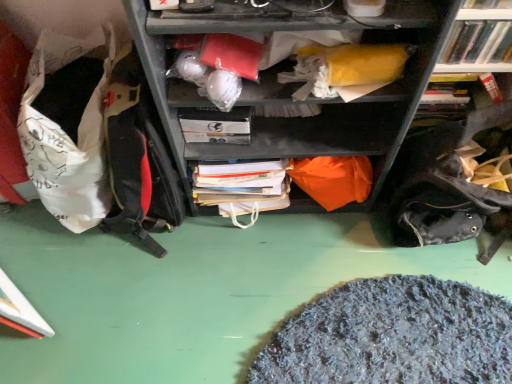
Question: Can we say white plastic books at upper right lies outside white fabric bean bag at left?

Choices:
 (A) yes
 (B) no

Answer: (A)

Question: Can you confirm if white plastic books at upper right is smaller than white fabric bean bag at left?

Choices:
 (A) no
 (B) yes

Answer: (B)

Question: From the image's perspective, is white plastic books at upper right over white fabric bean bag at left?

Choices:
 (A) yes
 (B) no

Answer: (A)

Question: Is white plastic books at upper right with white fabric bean bag at left?

Choices:
 (A) yes
 (B) no

Answer: (B)

Question: Can you confirm if white plastic books at upper right is shorter than white fabric bean bag at left?

Choices:
 (A) yes
 (B) no

Answer: (A)

Question: Does white plastic books at upper right have a larger size compared to white fabric bean bag at left?

Choices:
 (A) yes
 (B) no

Answer: (B)

Question: From a real-world perspective, does white plastic books at upper right stand above white matte paperback book at center?

Choices:
 (A) yes
 (B) no

Answer: (A)

Question: From the image's perspective, is white plastic books at upper right on top of white matte paperback book at center?

Choices:
 (A) yes
 (B) no

Answer: (A)

Question: Does white plastic books at upper right have a lesser width compared to white matte paperback book at center?

Choices:
 (A) yes
 (B) no

Answer: (A)

Question: Is white plastic books at upper right not close to white matte paperback book at center?

Choices:
 (A) no
 (B) yes

Answer: (A)

Question: Is white plastic books at upper right smaller than white matte paperback book at center?

Choices:
 (A) no
 (B) yes

Answer: (A)

Question: Is white plastic books at upper right aimed at white matte paperback book at center?

Choices:
 (A) yes
 (B) no

Answer: (B)

Question: Are white fabric bean bag at left and white plastic books at upper right far apart?

Choices:
 (A) yes
 (B) no

Answer: (B)